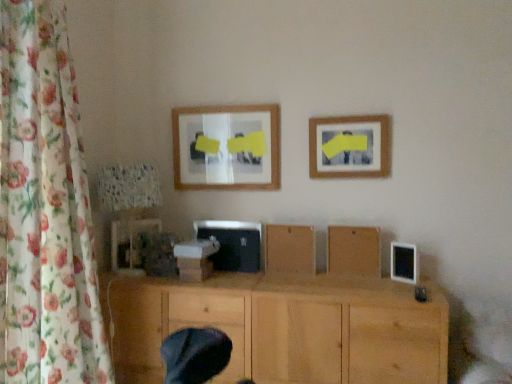
Question: From the image's perspective, does brown matte wood at center, the first wood viewed from the top, appear lower than floral fabric curtain at left?

Choices:
 (A) yes
 (B) no

Answer: (A)

Question: From a real-world perspective, is brown matte wood at center, acting as the third wood starting from the bottom, over floral fabric curtain at left?

Choices:
 (A) yes
 (B) no

Answer: (B)

Question: Considering the relative sizes of brown matte wood at center, the first wood viewed from the top, and floral fabric curtain at left in the image provided, is brown matte wood at center, the first wood viewed from the top, wider than floral fabric curtain at left?

Choices:
 (A) no
 (B) yes

Answer: (A)

Question: Does brown matte wood at center, acting as the third wood starting from the bottom, have a lesser width compared to floral fabric curtain at left?

Choices:
 (A) no
 (B) yes

Answer: (B)

Question: Considering the relative sizes of brown matte wood at center, acting as the third wood starting from the bottom, and floral fabric curtain at left in the image provided, is brown matte wood at center, acting as the third wood starting from the bottom, bigger than floral fabric curtain at left?

Choices:
 (A) yes
 (B) no

Answer: (B)

Question: Is brown matte wood at center, the first wood viewed from the top, oriented away from floral fabric curtain at left?

Choices:
 (A) no
 (B) yes

Answer: (A)

Question: Can you confirm if brown matte wood at center, acting as the third wood starting from the bottom, is taller than wooden board at center, the 2th wood in the top-to-bottom sequence?

Choices:
 (A) no
 (B) yes

Answer: (A)

Question: From a real-world perspective, is brown matte wood at center, the first wood viewed from the top, below wooden board at center, marked as the 2th wood in a bottom-to-top arrangement?

Choices:
 (A) yes
 (B) no

Answer: (B)

Question: From the image's perspective, would you say brown matte wood at center, the first wood viewed from the top, is positioned over wooden board at center, marked as the 2th wood in a bottom-to-top arrangement?

Choices:
 (A) no
 (B) yes

Answer: (B)

Question: Is brown matte wood at center, the first wood viewed from the top, behind wooden board at center, the 2th wood in the top-to-bottom sequence?

Choices:
 (A) no
 (B) yes

Answer: (B)

Question: Is brown matte wood at center, acting as the third wood starting from the bottom, positioned beyond the bounds of wooden board at center, marked as the 2th wood in a bottom-to-top arrangement?

Choices:
 (A) yes
 (B) no

Answer: (A)

Question: Is brown matte wood at center, the first wood viewed from the top, shorter than wooden board at center, the 2th wood in the top-to-bottom sequence?

Choices:
 (A) yes
 (B) no

Answer: (A)

Question: Is matte wooden picture frame at upper center, placed as the second picture frame when sorted from right to left, taller than matte plastic picture frame at lower left, the first picture frame viewed from the left?

Choices:
 (A) yes
 (B) no

Answer: (A)